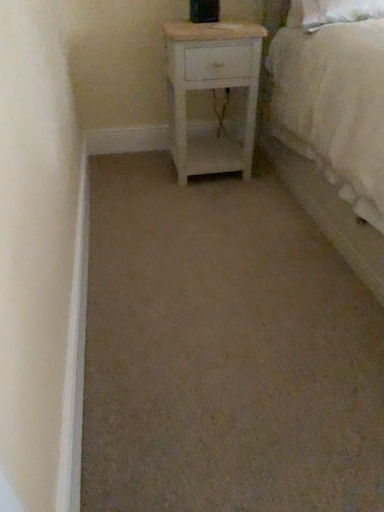
What are the coordinates of `free spot in front of white wood nightstand at center` in the screenshot? It's located at (221, 201).